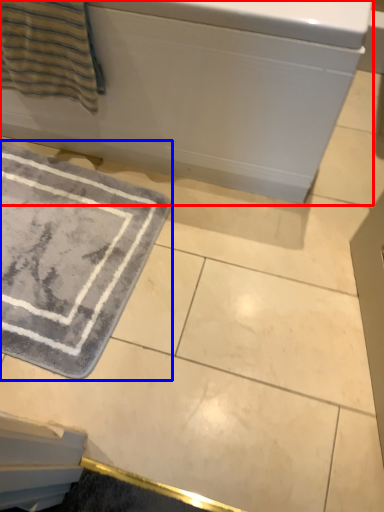
Question: Among these objects, which one is nearest to the camera, bath (highlighted by a red box) or bath mat (highlighted by a blue box)?

Choices:
 (A) bath
 (B) bath mat

Answer: (A)